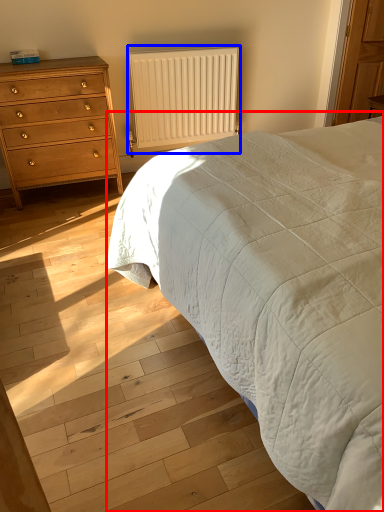
Question: Which object is closer to the camera taking this photo, bed (highlighted by a red box) or radiator (highlighted by a blue box)?

Choices:
 (A) bed
 (B) radiator

Answer: (A)